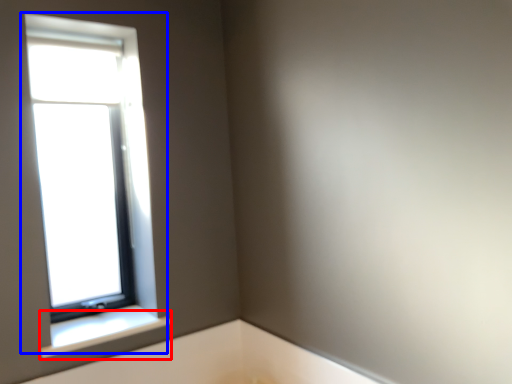
Question: Which point is further to the camera, window sill (highlighted by a red box) or window (highlighted by a blue box)?

Choices:
 (A) window sill
 (B) window

Answer: (B)